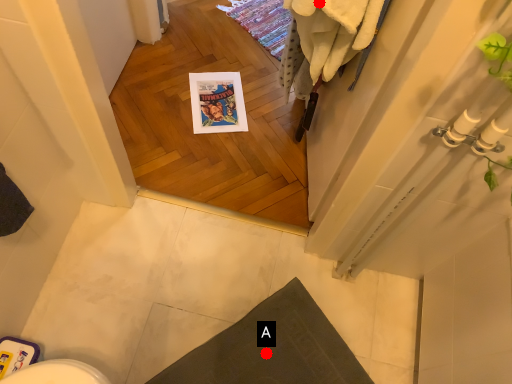
Question: Two points are circled on the image, labeled by A and B beside each circle. Which point is closer to the camera?

Choices:
 (A) A is closer
 (B) B is closer

Answer: (B)